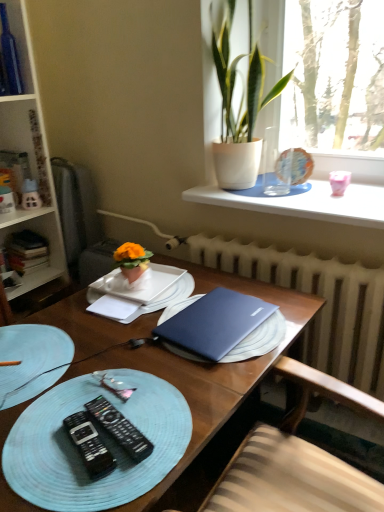
Identify the location of vacant space situated on the left part of white matte notebook at center. (69, 318).